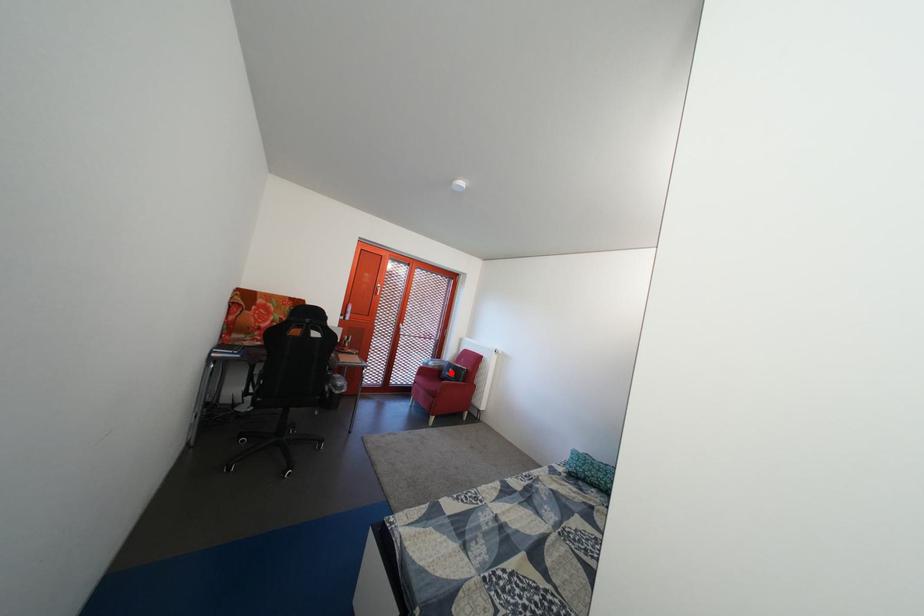
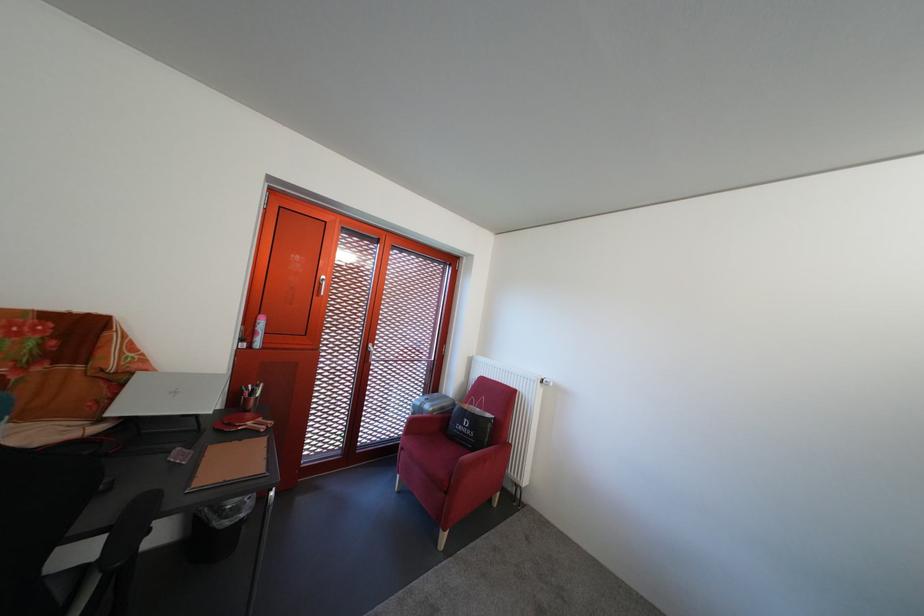
Locate, in the second image, the point that corresponds to the highlighted location in the first image.

(454, 415)